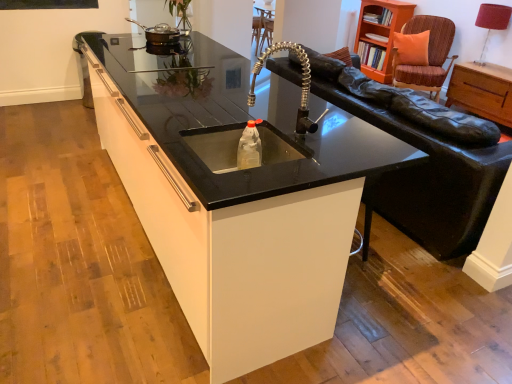
Question: Is translucent plastic bottle at center smaller than satin nickel faucet at center?

Choices:
 (A) yes
 (B) no

Answer: (A)

Question: Is translucent plastic bottle at center completely or partially outside of satin nickel faucet at center?

Choices:
 (A) yes
 (B) no

Answer: (A)

Question: Is satin nickel faucet at center surrounded by translucent plastic bottle at center?

Choices:
 (A) yes
 (B) no

Answer: (B)

Question: Does translucent plastic bottle at center turn towards satin nickel faucet at center?

Choices:
 (A) no
 (B) yes

Answer: (A)

Question: Does translucent plastic bottle at center have a lesser height compared to satin nickel faucet at center?

Choices:
 (A) yes
 (B) no

Answer: (A)

Question: From a real-world perspective, is translucent plastic bottle at center positioned under satin nickel faucet at center based on gravity?

Choices:
 (A) no
 (B) yes

Answer: (B)

Question: Considering the relative sizes of brown woven swivel chair at upper right and red fabric lampshade at upper right in the image provided, is brown woven swivel chair at upper right thinner than red fabric lampshade at upper right?

Choices:
 (A) no
 (B) yes

Answer: (A)

Question: From the image's perspective, is brown woven swivel chair at upper right above red fabric lampshade at upper right?

Choices:
 (A) no
 (B) yes

Answer: (A)

Question: Does brown woven swivel chair at upper right appear on the right side of red fabric lampshade at upper right?

Choices:
 (A) yes
 (B) no

Answer: (B)

Question: Are brown woven swivel chair at upper right and red fabric lampshade at upper right making contact?

Choices:
 (A) no
 (B) yes

Answer: (A)

Question: Does brown woven swivel chair at upper right turn towards red fabric lampshade at upper right?

Choices:
 (A) yes
 (B) no

Answer: (B)

Question: Can you confirm if brown woven swivel chair at upper right is smaller than red fabric lampshade at upper right?

Choices:
 (A) yes
 (B) no

Answer: (B)

Question: Is the depth of brown woven swivel chair at upper right greater than that of translucent plastic bottle at center?

Choices:
 (A) yes
 (B) no

Answer: (A)